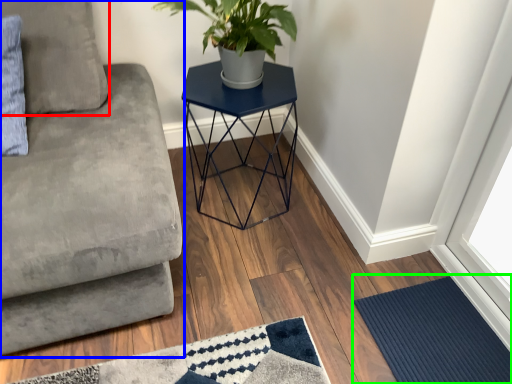
Question: Based on their relative distances, which object is farther from pillow (highlighted by a red box)? Choose from studio couch (highlighted by a blue box) and doormat (highlighted by a green box).

Choices:
 (A) studio couch
 (B) doormat

Answer: (B)